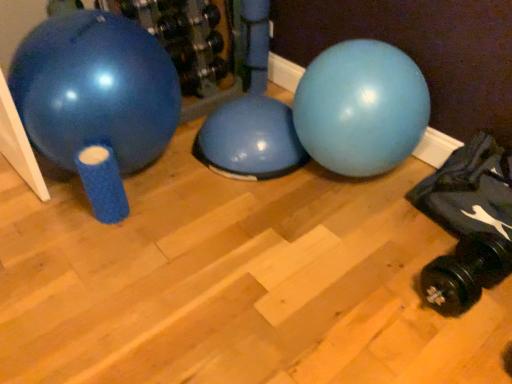
Question: Should I look upward or downward to see black rubber dumbbell at lower right?

Choices:
 (A) up
 (B) down

Answer: (B)

Question: Can you confirm if black rubber dumbbell at lower right is bigger than matte blue exercise ball at left?

Choices:
 (A) no
 (B) yes

Answer: (A)

Question: Is black rubber dumbbell at lower right not inside matte blue exercise ball at left?

Choices:
 (A) no
 (B) yes

Answer: (B)

Question: From a real-world perspective, is black rubber dumbbell at lower right positioned over matte blue exercise ball at left based on gravity?

Choices:
 (A) yes
 (B) no

Answer: (B)

Question: Is black rubber dumbbell at lower right looking in the opposite direction of matte blue exercise ball at left?

Choices:
 (A) no
 (B) yes

Answer: (A)

Question: Considering the relative sizes of black rubber dumbbell at lower right and matte blue exercise ball at left in the image provided, is black rubber dumbbell at lower right thinner than matte blue exercise ball at left?

Choices:
 (A) no
 (B) yes

Answer: (B)

Question: Considering the relative positions of black rubber dumbbell at lower right and matte blue exercise ball at left in the image provided, is black rubber dumbbell at lower right to the left of matte blue exercise ball at left from the viewer's perspective?

Choices:
 (A) yes
 (B) no

Answer: (B)

Question: Can you confirm if matte blue exercise ball at left is smaller than black rubber dumbbell at lower right?

Choices:
 (A) no
 (B) yes

Answer: (A)

Question: Does matte blue exercise ball at left come behind black rubber dumbbell at lower right?

Choices:
 (A) no
 (B) yes

Answer: (B)

Question: Could you tell me if matte blue exercise ball at left is turned towards black rubber dumbbell at lower right?

Choices:
 (A) yes
 (B) no

Answer: (A)

Question: From the image's perspective, is matte blue exercise ball at left beneath black rubber dumbbell at lower right?

Choices:
 (A) yes
 (B) no

Answer: (B)

Question: Are matte blue exercise ball at left and black rubber dumbbell at lower right located far from each other?

Choices:
 (A) yes
 (B) no

Answer: (A)

Question: Is matte blue exercise ball at left in front of black rubber dumbbell at lower right?

Choices:
 (A) yes
 (B) no

Answer: (B)

Question: From their relative heights in the image, would you say black rubber dumbbell at lower right is taller or shorter than matte blue exercise ball at left?

Choices:
 (A) short
 (B) tall

Answer: (A)